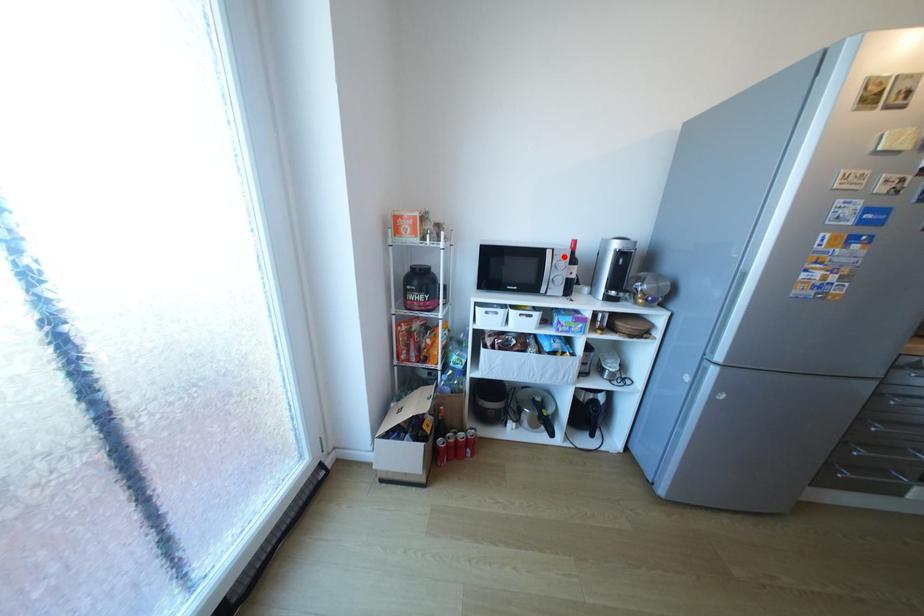
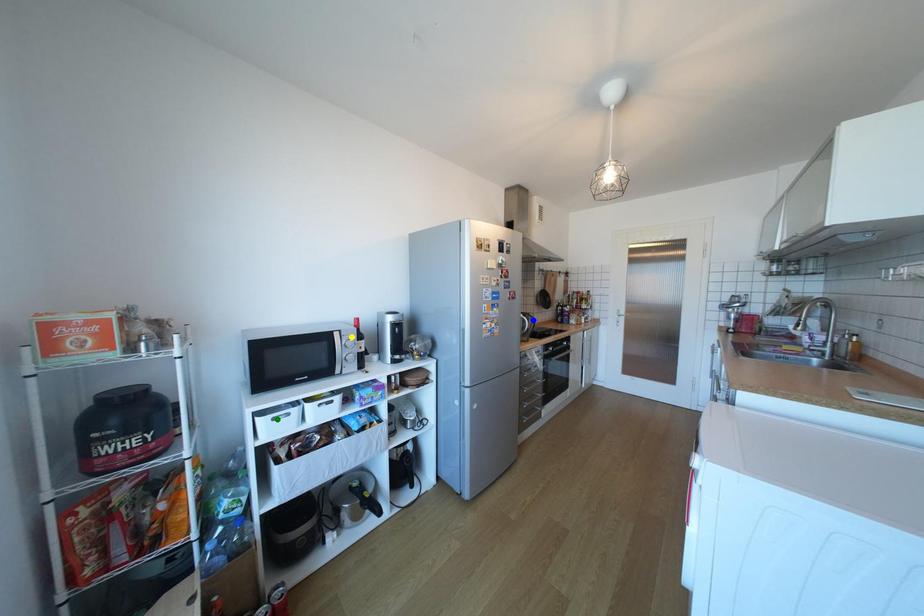
Question: I am providing you with two images of the same scene from different viewpoints. A red point is marked on the first image. You are given multiple points on the second image. Which mark in image 2 goes with the point in image 1?

Choices:
 (A) blue point
 (B) yellow point
 (C) green point

Answer: (B)